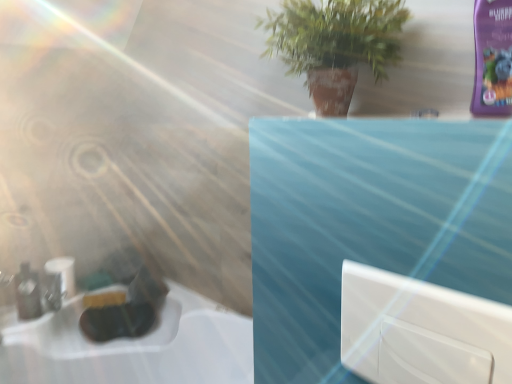
What do you see at coordinates (335, 44) in the screenshot? I see `green matte plant at upper center` at bounding box center [335, 44].

The image size is (512, 384). What are the coordinates of `matte black bottle at left` in the screenshot? It's located at (27, 293).

Image resolution: width=512 pixels, height=384 pixels. Describe the element at coordinates (417, 318) in the screenshot. I see `white glossy window at center` at that location.

From the picture: What is the approximate width of white matte toilet paper at lower left?

It is 4.05 inches.

The height and width of the screenshot is (384, 512). Describe the element at coordinates (63, 274) in the screenshot. I see `white matte toilet paper at lower left` at that location.

Locate an element on the screen. The height and width of the screenshot is (384, 512). green matte plant at upper center is located at coordinates (335, 44).

From a real-world perspective, is white glossy window at center physically below white matte toilet paper at lower left?

No, from a real-world perspective, white glossy window at center is not below white matte toilet paper at lower left.

Find the location of `window above the white matte toilet paper at lower left (from a real-world perspective)`. window above the white matte toilet paper at lower left (from a real-world perspective) is located at coordinates (417, 318).

Would you say white glossy window at center is inside or outside white matte toilet paper at lower left?

white glossy window at center is not enclosed by white matte toilet paper at lower left.

From a real-world perspective, relative to green matte plant at upper center, is white glossy window at center vertically above or below?

From a real-world perspective, white glossy window at center is physically below green matte plant at upper center.

Considering the sizes of white glossy window at center and green matte plant at upper center in the image, is white glossy window at center taller or shorter than green matte plant at upper center?

In the image, white glossy window at center appears to be shorter than green matte plant at upper center.

Considering the sizes of objects white glossy window at center and green matte plant at upper center in the image provided, who is smaller, white glossy window at center or green matte plant at upper center?

white glossy window at center.

Is white glossy window at center positioned with its back to green matte plant at upper center?

No, white glossy window at center is not facing the opposite direction of green matte plant at upper center.

Does white matte toilet paper at lower left have a greater height compared to green matte plant at upper center?

No, white matte toilet paper at lower left is not taller than green matte plant at upper center.

Is white matte toilet paper at lower left oriented away from green matte plant at upper center?

white matte toilet paper at lower left is not turned away from green matte plant at upper center.

Relative to green matte plant at upper center, is white matte toilet paper at lower left in front or behind?

Clearly, white matte toilet paper at lower left is behind green matte plant at upper center.

From the image's perspective, between white matte toilet paper at lower left and green matte plant at upper center, which one is located above?

green matte plant at upper center is shown above in the image.

Where is `mouthwash lying below the green matte plant at upper center (from the image's perspective)`? This screenshot has width=512, height=384. mouthwash lying below the green matte plant at upper center (from the image's perspective) is located at coordinates (27, 293).

Consider the image. Could you tell me if matte black bottle at left is facing green matte plant at upper center?

No, matte black bottle at left does not turn towards green matte plant at upper center.

Can you confirm if matte black bottle at left is positioned to the left of green matte plant at upper center?

Indeed, matte black bottle at left is positioned on the left side of green matte plant at upper center.

Does point (37, 307) appear closer or farther from the camera than point (393, 14)?

Point (37, 307).

Is point (57, 273) in front of point (435, 313)?

No.

Which of these two, white matte toilet paper at lower left or white glossy window at center, is bigger?

With larger size is white glossy window at center.

Considering the relative positions of white matte toilet paper at lower left and white glossy window at center in the image provided, is white matte toilet paper at lower left in front of white glossy window at center?

No.

Could you tell me if matte black bottle at left is facing white matte toilet paper at lower left?

No, matte black bottle at left is not oriented towards white matte toilet paper at lower left.

Is matte black bottle at left bigger than white matte toilet paper at lower left?

No.

From a real-world perspective, is matte black bottle at left over white matte toilet paper at lower left?

Yes, from a real-world perspective, matte black bottle at left is above white matte toilet paper at lower left.

Would you say matte black bottle at left contains white matte toilet paper at lower left?

No, white matte toilet paper at lower left is not surrounded by matte black bottle at left.

Could you tell me if white matte toilet paper at lower left is turned towards matte black bottle at left?

No, white matte toilet paper at lower left is not aimed at matte black bottle at left.

Based on their sizes in the image, would you say white matte toilet paper at lower left is bigger or smaller than matte black bottle at left?

Clearly, white matte toilet paper at lower left is larger in size than matte black bottle at left.

The height and width of the screenshot is (384, 512). I want to click on toilet paper that is above the matte black bottle at left (from the image's perspective), so click(x=63, y=274).

From a real-world perspective, is white matte toilet paper at lower left physically above matte black bottle at left?

No.

You are a GUI agent. You are given a task and a screenshot of the screen. Output one action in this format:
    pyautogui.click(x=<x>, y=<y>)
    Task: Click on the toilet paper below the white glossy window at center (from the image's perspective)
    
    Given the screenshot: What is the action you would take?
    click(63, 274)

Where is `window in front of the green matte plant at upper center`? The height and width of the screenshot is (384, 512). window in front of the green matte plant at upper center is located at coordinates (417, 318).

Consider the image. Considering their positions, is green matte plant at upper center positioned further to white glossy window at center than white matte toilet paper at lower left?

Among the two, white matte toilet paper at lower left is located further to white glossy window at center.

Estimate the real-world distances between objects in this image. Which object is further from white glossy window at center, green matte plant at upper center or matte black bottle at left?

matte black bottle at left.

Based on their spatial positions, is matte black bottle at left or green matte plant at upper center closer to white matte toilet paper at lower left?

The object closer to white matte toilet paper at lower left is matte black bottle at left.

Looking at the image, which one is located further to white matte toilet paper at lower left, white glossy window at center or matte black bottle at left?

Based on the image, white glossy window at center appears to be further to white matte toilet paper at lower left.

Based on their spatial positions, is green matte plant at upper center or white glossy window at center closer to matte black bottle at left?

green matte plant at upper center is closer to matte black bottle at left.

Based on their spatial positions, is green matte plant at upper center or matte black bottle at left further from white matte toilet paper at lower left?

green matte plant at upper center.

Estimate the real-world distances between objects in this image. Which object is closer to white glossy window at center, matte black bottle at left or white matte toilet paper at lower left?

white matte toilet paper at lower left is closer to white glossy window at center.

Estimate the real-world distances between objects in this image. Which object is closer to matte black bottle at left, green matte plant at upper center or white matte toilet paper at lower left?

Based on the image, white matte toilet paper at lower left appears to be nearer to matte black bottle at left.

This screenshot has width=512, height=384. Find the location of `mouthwash positioned between green matte plant at upper center and white matte toilet paper at lower left from near to far`. mouthwash positioned between green matte plant at upper center and white matte toilet paper at lower left from near to far is located at coordinates (27, 293).

This screenshot has width=512, height=384. Find the location of `houseplant between matte black bottle at left and white glossy window at center from left to right`. houseplant between matte black bottle at left and white glossy window at center from left to right is located at coordinates (335, 44).

Find the location of a particular element. houseplant between white glossy window at center and white matte toilet paper at lower left from front to back is located at coordinates (335, 44).

You are a GUI agent. You are given a task and a screenshot of the screen. Output one action in this format:
    pyautogui.click(x=<x>, y=<y>)
    Task: Click on the mouthwash between white glossy window at center and white matte toilet paper at lower left from front to back
    
    Given the screenshot: What is the action you would take?
    pyautogui.click(x=27, y=293)